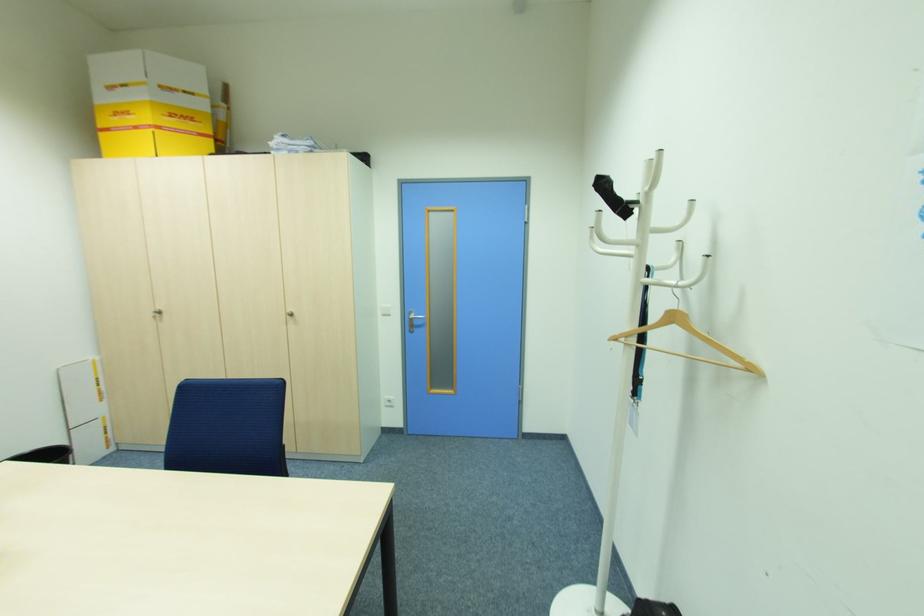
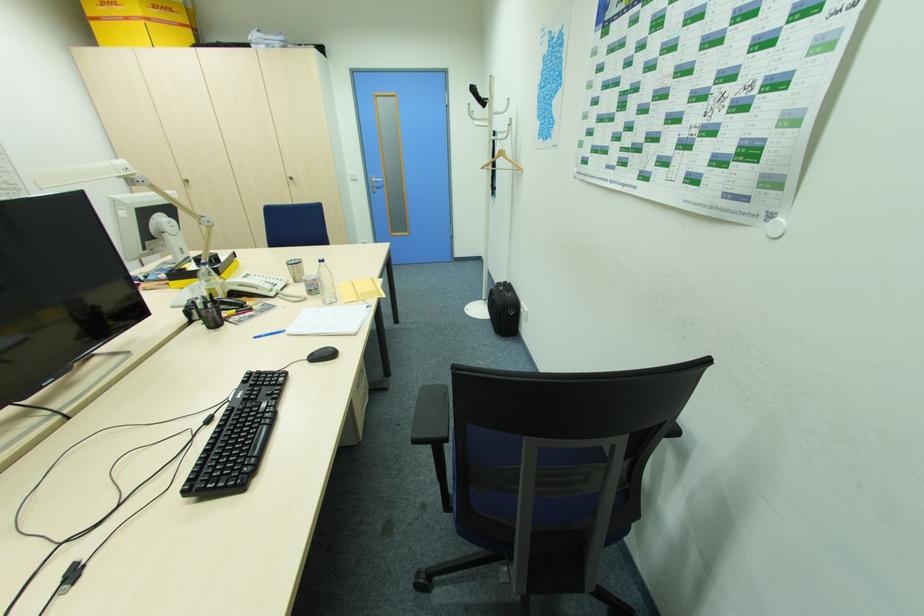
Where in the second image is the point corresponding to point 292,310 from the first image?

(292, 176)